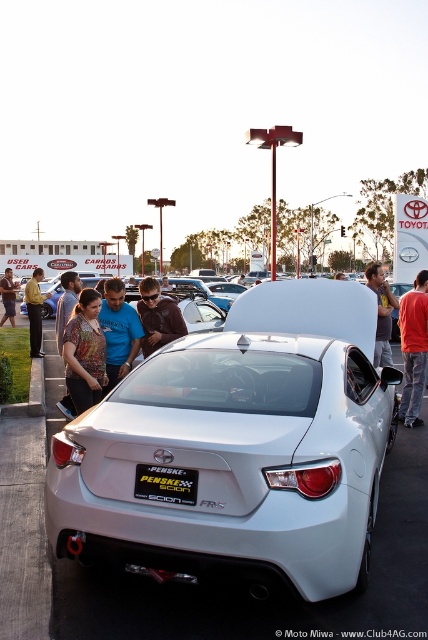
In order to click on brown leather jacket at center in this screenshot , I will do `click(157, 316)`.

Is the position of satin white sedan at center less distant than that of yellow shirt at left?

Yes, satin white sedan at center is in front of yellow shirt at left.

Can you confirm if satin white sedan at center is thinner than yellow shirt at left?

Yes, satin white sedan at center is thinner than yellow shirt at left.

This screenshot has height=640, width=428. I want to click on satin white sedan at center, so click(240, 449).

Between black plastic license plate at rear and matte brown shirt at center, which one is positioned lower?

black plastic license plate at rear is below.

This screenshot has height=640, width=428. Describe the element at coordinates (166, 483) in the screenshot. I see `black plastic license plate at rear` at that location.

At what (x,y) coordinates should I click in order to perform the action: click on black plastic license plate at rear. Please return your answer as a coordinate pair (x, y). The image size is (428, 640). Looking at the image, I should click on (166, 483).

In order to click on black plastic license plate at rear in this screenshot , I will do `click(166, 483)`.